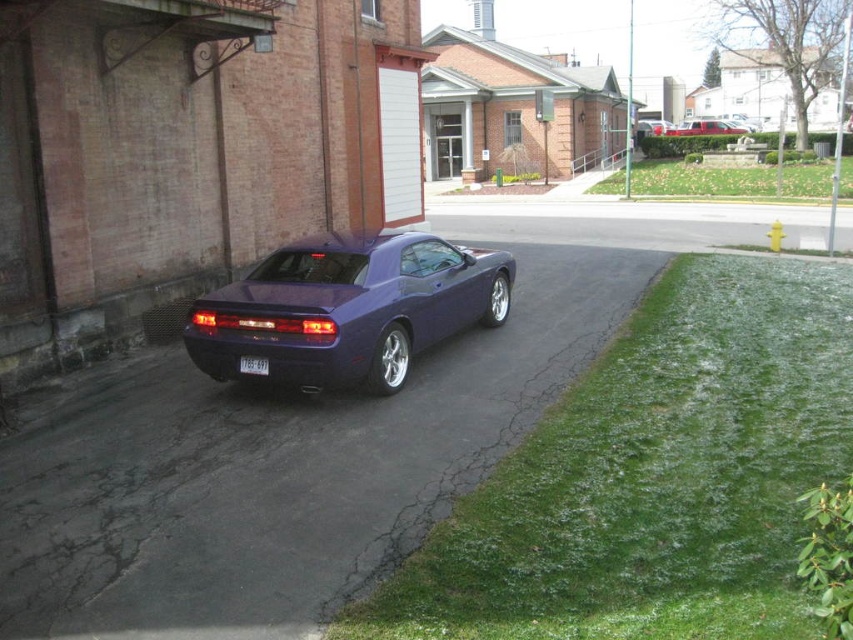
The height and width of the screenshot is (640, 853). Describe the element at coordinates (705, 128) in the screenshot. I see `metallic red truck at upper right` at that location.

Between point (688, 129) and point (647, 129), which one is positioned behind?

Positioned behind is point (688, 129).

Does point (711, 131) come behind point (660, 132)?

No, (711, 131) is in front of (660, 132).

At what (x,y) coordinates should I click in order to perform the action: click on metallic red truck at upper right. Please return your answer as a coordinate pair (x, y). The image size is (853, 640). Looking at the image, I should click on (705, 128).

Is point (700, 132) farther from camera compared to point (248, 364)?

Yes, point (700, 132) is farther from viewer.

Which is above, metallic red truck at upper right or white plastic license plate at center?

metallic red truck at upper right is above.

Describe the element at coordinates (705, 128) in the screenshot. I see `metallic red truck at upper right` at that location.

Identify the location of metallic red truck at upper right. (705, 128).

Between point (194, 627) and point (741, 129), which one is positioned behind?

Positioned behind is point (741, 129).

Does glossy metallic car at center appear over metallic red truck at upper right?

No.

Image resolution: width=853 pixels, height=640 pixels. What do you see at coordinates (276, 472) in the screenshot? I see `glossy metallic car at center` at bounding box center [276, 472].

The width and height of the screenshot is (853, 640). I want to click on glossy metallic car at center, so click(276, 472).